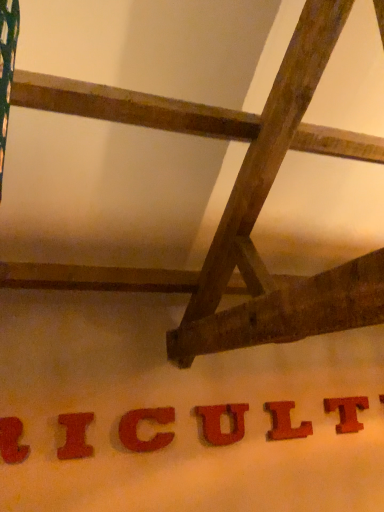
Question: Does matte red letter at lower left, which is the sixth letter from right to left, contain red matte letter c at center, acting as the fourth letter starting from the right?

Choices:
 (A) yes
 (B) no

Answer: (B)

Question: Can you confirm if matte red letter at lower left, which is the sixth letter from right to left, is positioned to the right of red matte letter c at center, acting as the fourth letter starting from the right?

Choices:
 (A) no
 (B) yes

Answer: (A)

Question: Does matte red letter at lower left, the first letter when ordered from left to right, have a lesser width compared to red matte letter c at center, acting as the 3th letter starting from the left?

Choices:
 (A) yes
 (B) no

Answer: (B)

Question: Considering the relative positions of matte red letter at lower left, which is the sixth letter from right to left, and red matte letter c at center, acting as the fourth letter starting from the right, in the image provided, is matte red letter at lower left, which is the sixth letter from right to left, to the left of red matte letter c at center, acting as the fourth letter starting from the right, from the viewer's perspective?

Choices:
 (A) yes
 (B) no

Answer: (A)

Question: From a real-world perspective, is matte red letter at lower left, the first letter when ordered from left to right, below red matte letter c at center, acting as the fourth letter starting from the right?

Choices:
 (A) yes
 (B) no

Answer: (B)

Question: Considering the positions of point (274, 420) and point (147, 441), is point (274, 420) closer or farther from the camera than point (147, 441)?

Choices:
 (A) closer
 (B) farther

Answer: (B)

Question: Visually, is wooden letter l at center, the 5th letter viewed from the left, positioned to the left or to the right of red matte letter c at center, acting as the fourth letter starting from the right?

Choices:
 (A) left
 (B) right

Answer: (B)

Question: Is wooden letter l at center, arranged as the second letter when viewed from the right, inside the boundaries of red matte letter c at center, acting as the 3th letter starting from the left, or outside?

Choices:
 (A) inside
 (B) outside

Answer: (B)

Question: In terms of height, does wooden letter l at center, arranged as the second letter when viewed from the right, look taller or shorter compared to red matte letter c at center, acting as the 3th letter starting from the left?

Choices:
 (A) tall
 (B) short

Answer: (A)

Question: Choose the correct answer: Is red matte letter c at center, acting as the 3th letter starting from the left, inside wooden letter l at center, the 5th letter viewed from the left, or outside it?

Choices:
 (A) outside
 (B) inside

Answer: (A)

Question: From their relative heights in the image, would you say red matte letter c at center, acting as the fourth letter starting from the right, is taller or shorter than wooden letter l at center, the 5th letter viewed from the left?

Choices:
 (A) short
 (B) tall

Answer: (A)

Question: Is point (130, 438) positioned closer to the camera than point (286, 421)?

Choices:
 (A) farther
 (B) closer

Answer: (B)

Question: From the image's perspective, is red matte letter c at center, acting as the 3th letter starting from the left, above or below wooden letter l at center, arranged as the second letter when viewed from the right?

Choices:
 (A) below
 (B) above

Answer: (B)

Question: Is point (359, 396) closer or farther from the camera than point (196, 412)?

Choices:
 (A) farther
 (B) closer

Answer: (A)

Question: From a real-world perspective, is red wood letter t at lower right, the sixth letter viewed from the left, physically located above or below rustic wood letter u at center, the third letter positioned from the right?

Choices:
 (A) below
 (B) above

Answer: (B)